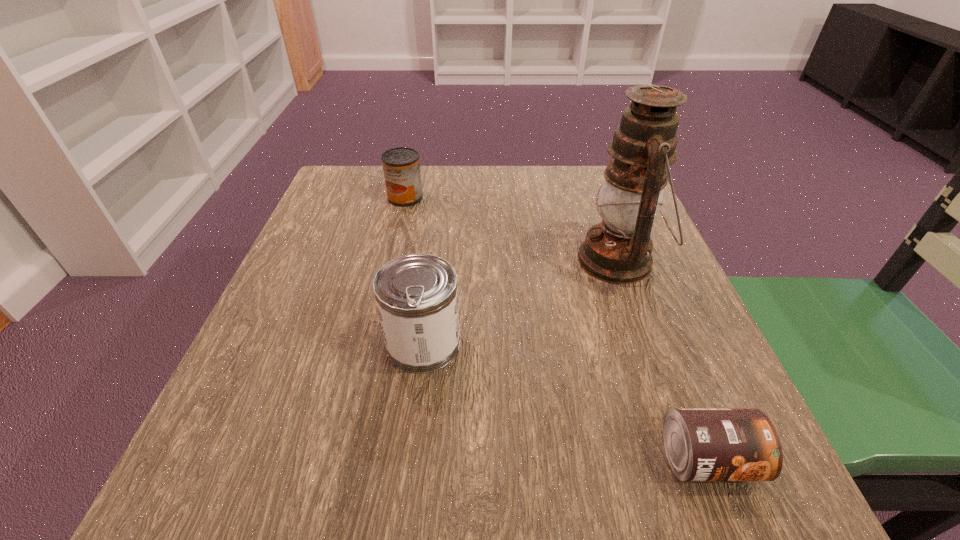
You are a GUI agent. You are given a task and a screenshot of the screen. Output one action in this format:
    pyautogui.click(x=<x>, y=<y>)
    Task: Click on the vacant area at the left edge
    The height and width of the screenshot is (540, 960).
    Given the screenshot: What is the action you would take?
    pyautogui.click(x=337, y=343)

Find the location of a particular element. This screenshot has width=960, height=540. vacant space at the far left corner of the desktop is located at coordinates (380, 208).

You are a GUI agent. You are given a task and a screenshot of the screen. Output one action in this format:
    pyautogui.click(x=<x>, y=<y>)
    Task: Click on the vacant area at the near left corner
    The width and height of the screenshot is (960, 540).
    Given the screenshot: What is the action you would take?
    pyautogui.click(x=303, y=501)

This screenshot has height=540, width=960. Find the location of `free space at the far right corner`. free space at the far right corner is located at coordinates (601, 176).

Image resolution: width=960 pixels, height=540 pixels. I want to click on vacant space at the near right corner, so click(729, 494).

I want to click on empty space that is in between the shortest can and the third nearest object, so click(662, 360).

At what (x,y) coordinates should I click in order to perform the action: click on empty space that is in between the lantern and the farthest object. Please return your answer as a coordinate pair (x, y). The image size is (960, 540). Looking at the image, I should click on (512, 228).

The width and height of the screenshot is (960, 540). What are the coordinates of `free spot between the second nearest object and the nearest object` in the screenshot? It's located at (565, 401).

The width and height of the screenshot is (960, 540). Find the location of `vacant space that's between the nearest object and the lantern`. vacant space that's between the nearest object and the lantern is located at coordinates click(x=662, y=360).

Image resolution: width=960 pixels, height=540 pixels. Identify the location of vacant area between the shortest can and the second farthest can. (565, 401).